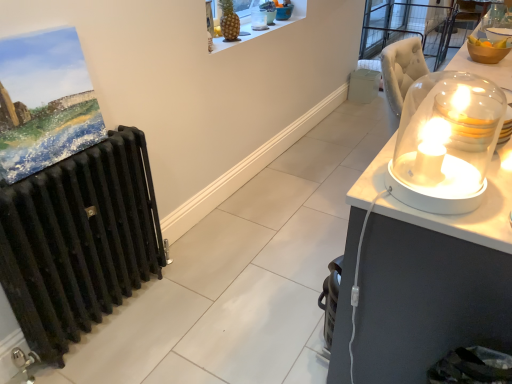
Locate an element on the screen. free location to the right of black cast iron radiator at left is located at coordinates (190, 331).